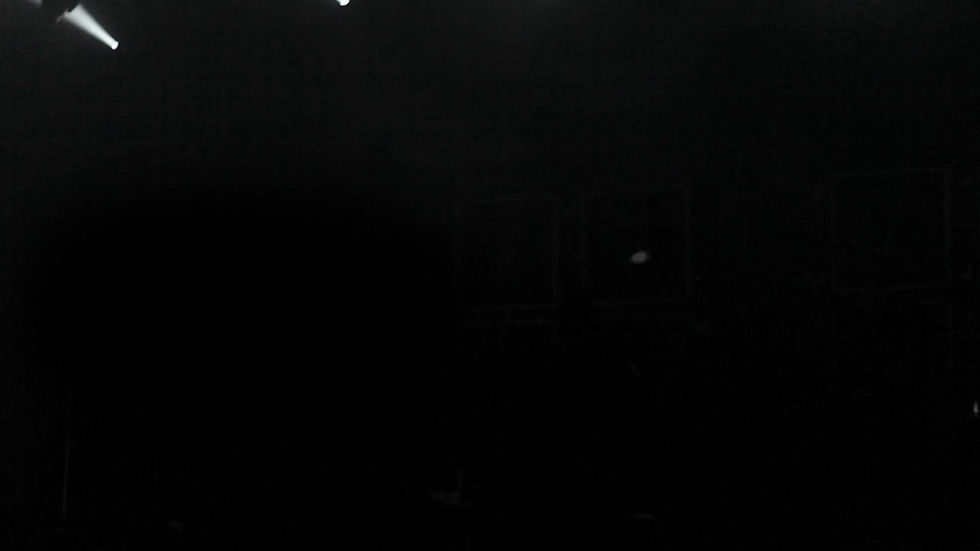
The image size is (980, 551). I want to click on spotlight, so click(x=102, y=37).